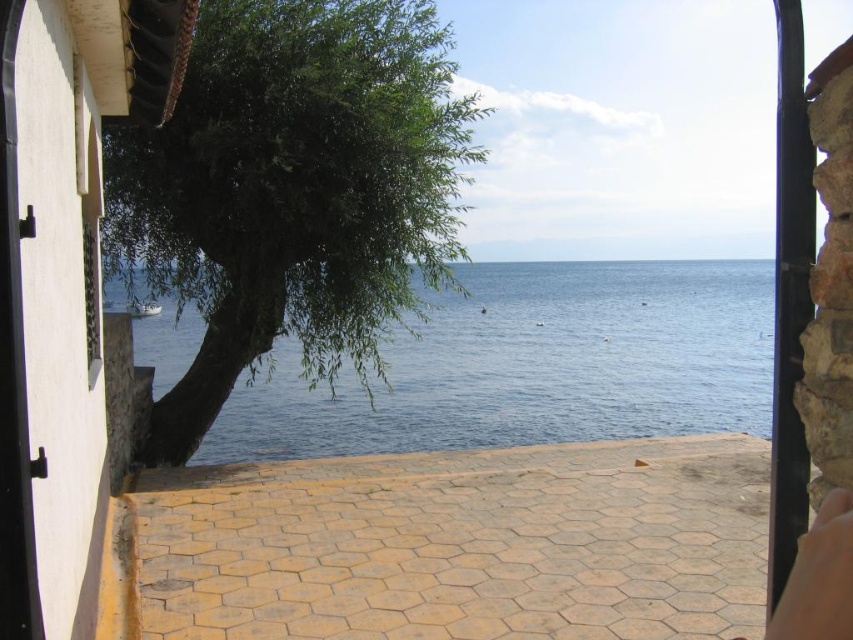
Is green leafy tree at left taller than blue water at center?

Yes.

Does point (457, 248) come behind point (474, 300)?

That is False.

Where is `green leafy tree at left`? green leafy tree at left is located at coordinates (291, 192).

Is green leafy tree at left behind smooth skin at lower right?

Yes, green leafy tree at left is behind smooth skin at lower right.

Who is shorter, green leafy tree at left or smooth skin at lower right?

Standing shorter between the two is smooth skin at lower right.

Who is more distant from viewer, [339,310] or [845,488]?

The point [339,310] is more distant.

Where is `green leafy tree at left`? green leafy tree at left is located at coordinates (291, 192).

Between blue water at center and smooth skin at lower right, which one has less height?

With less height is smooth skin at lower right.

Is blue water at center bigger than smooth skin at lower right?

Indeed, blue water at center has a larger size compared to smooth skin at lower right.

Between point (579, 412) and point (822, 627), which one is positioned in front?

Point (822, 627) is in front.

I want to click on blue water at center, so click(523, 365).